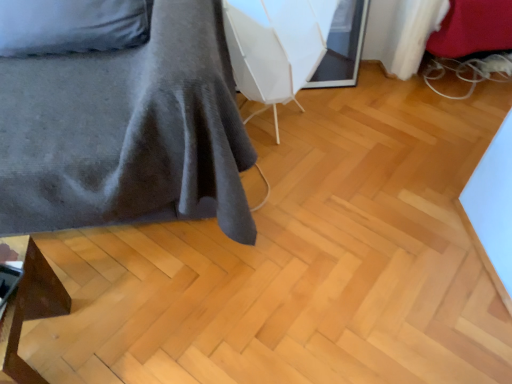
This screenshot has height=384, width=512. I want to click on vacant area that lies to the right of white plastic swivel chair at center, so click(x=352, y=131).